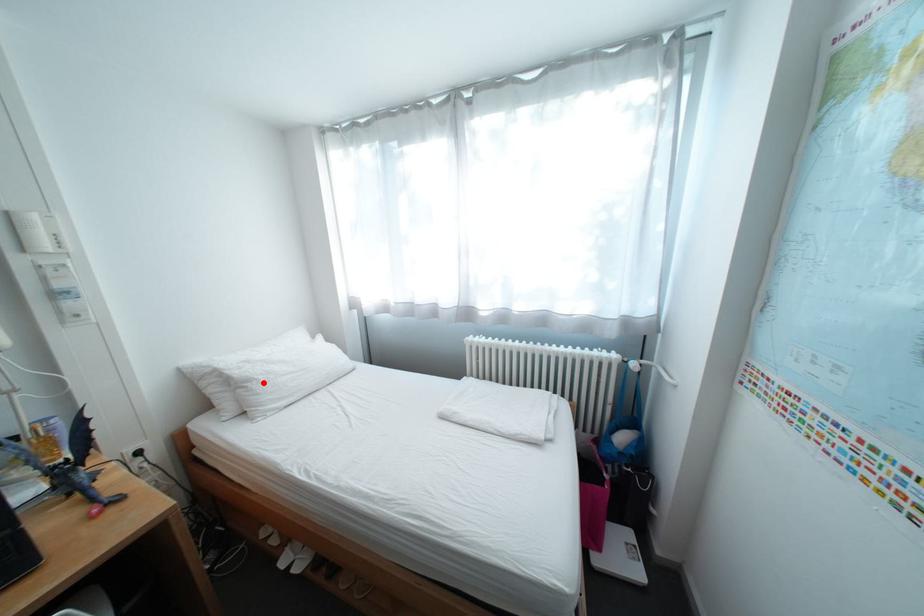
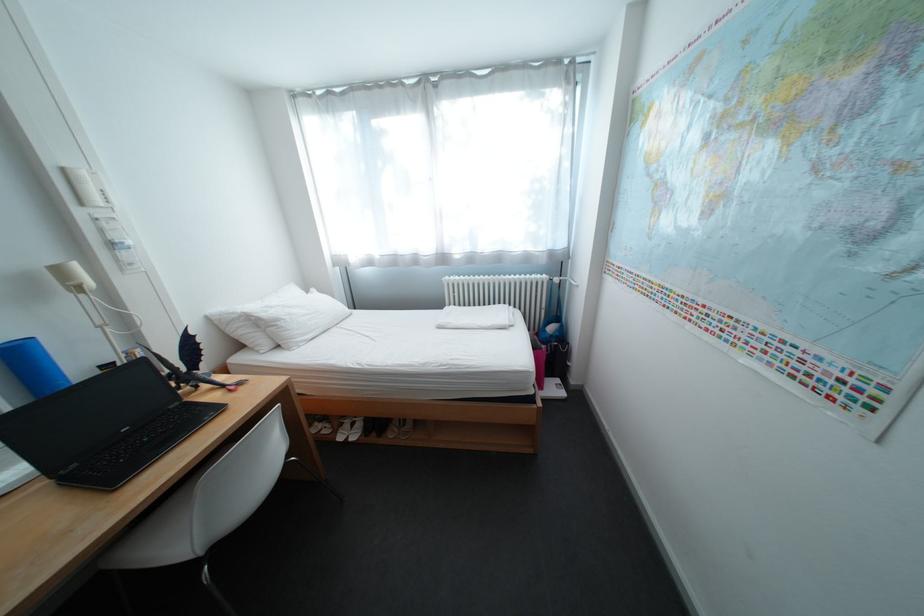
In the second image, find the point that corresponds to the highlighted location in the first image.

(292, 322)